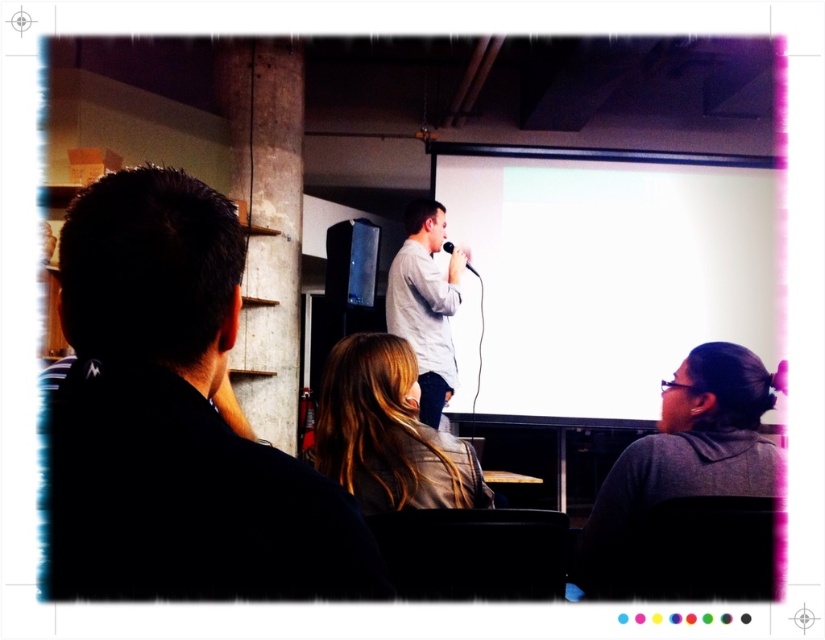
You are sitting in the front row of the audience and want to hand a note to the person wearing the gray matte jacket at lower right. Since you can only see their back, where should you look to find them relative to the blonde hair at center?

The gray matte jacket at lower right is located below the blonde hair at center, so you should look downward from the blonde hair at center to locate them.

Consider the image. You are attending a meeting and notice two features of the central speaker. Which one is shorter, the blonde hair at center or the white matte shirt at center?

The blonde hair at center is shorter than the white matte shirt at center.